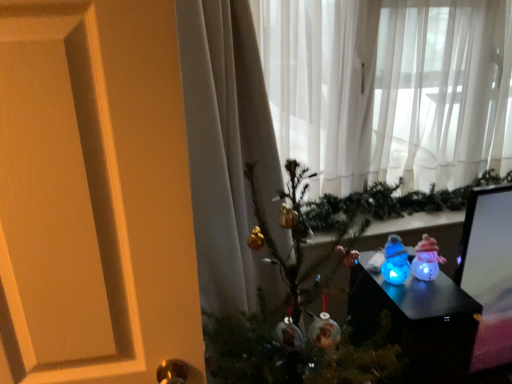
Where is `free location in front of blue translucent snowman at center, the first toy from the left`? The image size is (512, 384). free location in front of blue translucent snowman at center, the first toy from the left is located at coordinates (420, 303).